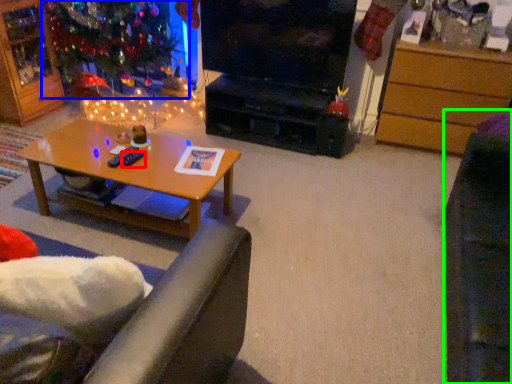
Question: Considering the real-world distances, which object is closest to remote control (highlighted by a red box)? christmas tree (highlighted by a blue box) or swivel chair (highlighted by a green box).

Choices:
 (A) christmas tree
 (B) swivel chair

Answer: (B)